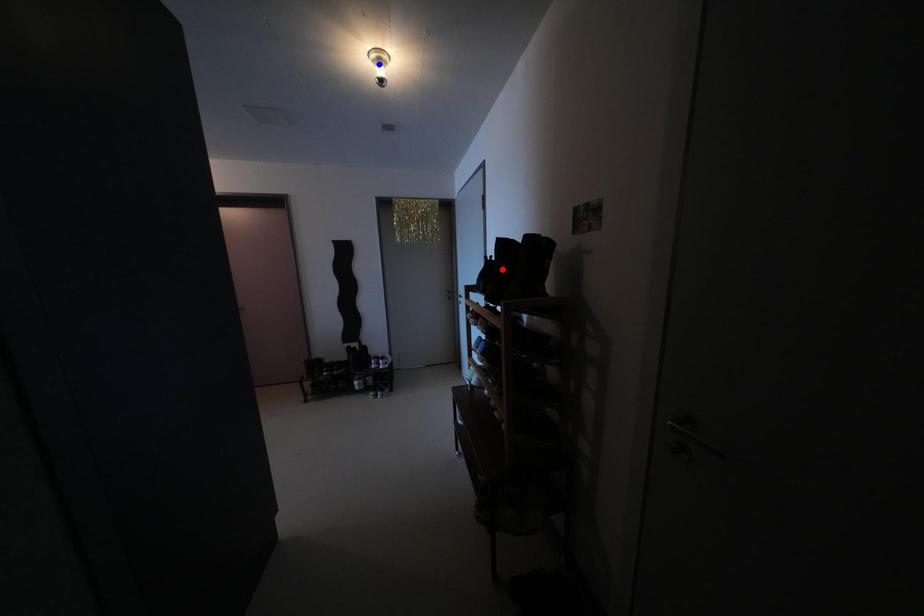
Question: In the image, two points are highlighted. Which point is nearer to the camera? Reply with the corresponding letter.

Choices:
 (A) blue point
 (B) red point

Answer: (A)